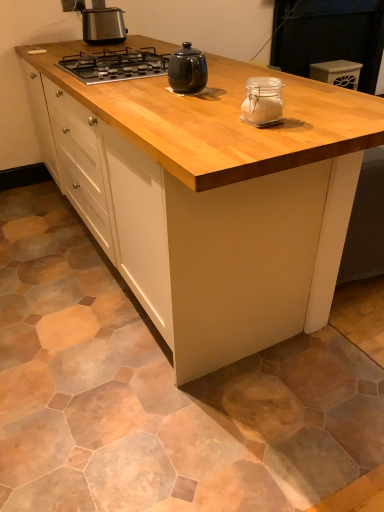
Question: Considering the relative sizes of black glass gas stove at upper center and clear glass jar at center, which is the first kitchen appliance from right to left, in the image provided, is black glass gas stove at upper center taller than clear glass jar at center, which is the first kitchen appliance from right to left,?

Choices:
 (A) yes
 (B) no

Answer: (B)

Question: From the image's perspective, would you say black glass gas stove at upper center is positioned over clear glass jar at center, the 3th kitchen appliance viewed from the back?

Choices:
 (A) yes
 (B) no

Answer: (A)

Question: Is black glass gas stove at upper center positioned before clear glass jar at center, the 3th kitchen appliance viewed from the back?

Choices:
 (A) yes
 (B) no

Answer: (B)

Question: Is black glass gas stove at upper center at the left side of clear glass jar at center, which ranks as the third kitchen appliance in top-to-bottom order?

Choices:
 (A) no
 (B) yes

Answer: (B)

Question: Can you confirm if black glass gas stove at upper center is bigger than clear glass jar at center, the 3th kitchen appliance viewed from the back?

Choices:
 (A) yes
 (B) no

Answer: (A)

Question: From a real-world perspective, relative to satin black toaster at upper left, the third kitchen appliance positioned from the front, is white plastic container at upper right vertically above or below?

Choices:
 (A) below
 (B) above

Answer: (A)

Question: Does point (342, 66) appear closer or farther from the camera than point (84, 13)?

Choices:
 (A) farther
 (B) closer

Answer: (A)

Question: Is white plastic container at upper right situated inside satin black toaster at upper left, marked as the first kitchen appliance in a top-to-bottom arrangement, or outside?

Choices:
 (A) inside
 (B) outside

Answer: (B)

Question: Is white plastic container at upper right taller or shorter than satin black toaster at upper left, marked as the 3th kitchen appliance in a bottom-to-top arrangement?

Choices:
 (A) short
 (B) tall

Answer: (B)

Question: Which is correct: satin black toaster at upper left, marked as the first kitchen appliance in a top-to-bottom arrangement, is inside black glass gas stove at upper center, or outside of it?

Choices:
 (A) inside
 (B) outside

Answer: (B)

Question: Based on their positions, is satin black toaster at upper left, which ranks as the first kitchen appliance in back-to-front order, located to the left or right of black glass gas stove at upper center?

Choices:
 (A) right
 (B) left

Answer: (B)

Question: Is satin black toaster at upper left, marked as the 3th kitchen appliance in a bottom-to-top arrangement, wider or thinner than black glass gas stove at upper center?

Choices:
 (A) thin
 (B) wide

Answer: (A)

Question: From a real-world perspective, is satin black toaster at upper left, the 1th kitchen appliance viewed from the left, positioned above or below black glass gas stove at upper center?

Choices:
 (A) above
 (B) below

Answer: (A)

Question: Is point (97, 53) closer or farther from the camera than point (185, 47)?

Choices:
 (A) farther
 (B) closer

Answer: (A)

Question: Considering the relative positions of black glass gas stove at upper center and glossy ceramic mug at upper center, which ranks as the second kitchen appliance in bottom-to-top order, in the image provided, is black glass gas stove at upper center to the left or to the right of glossy ceramic mug at upper center, which ranks as the second kitchen appliance in bottom-to-top order,?

Choices:
 (A) left
 (B) right

Answer: (A)